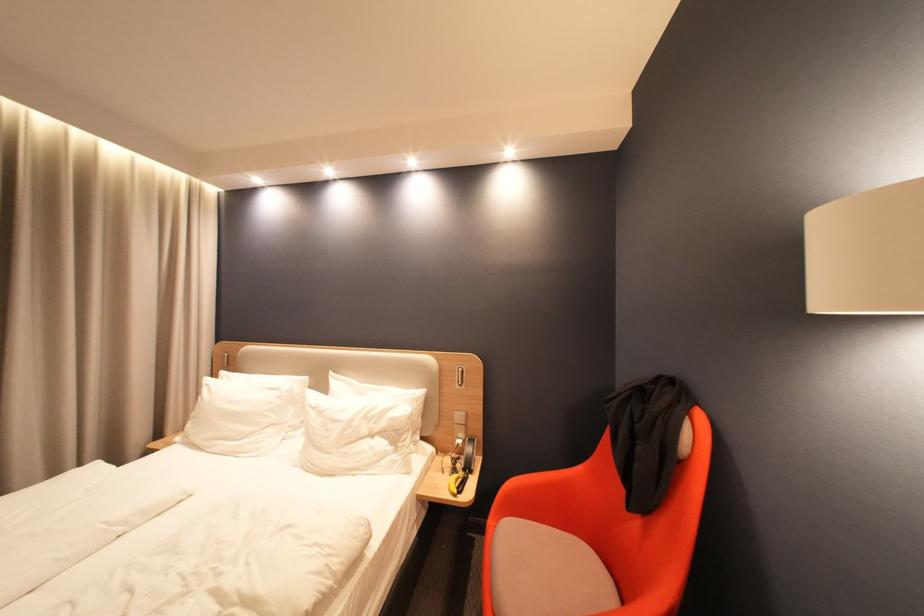
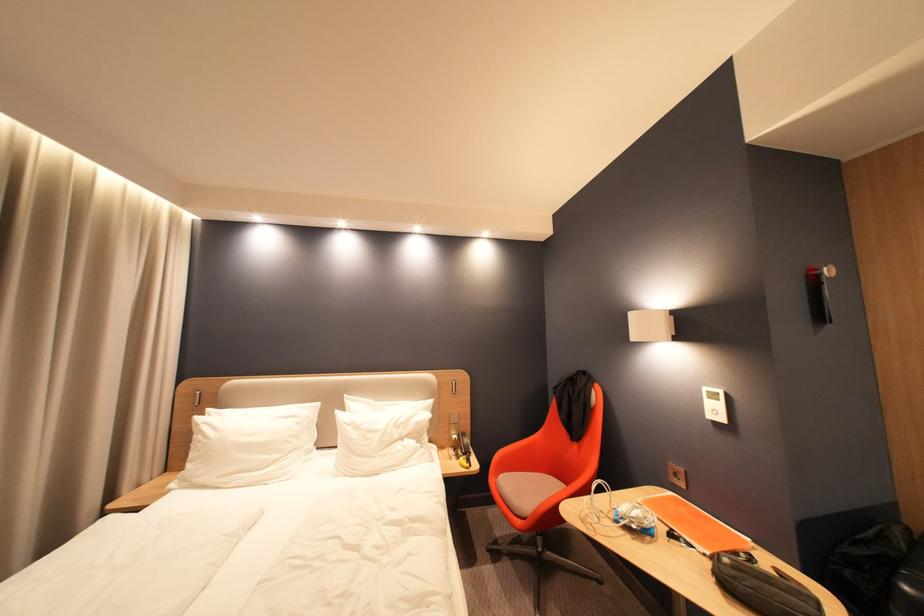
The point at (323,407) is marked in the first image. Where is the corresponding point in the second image?

(359, 424)